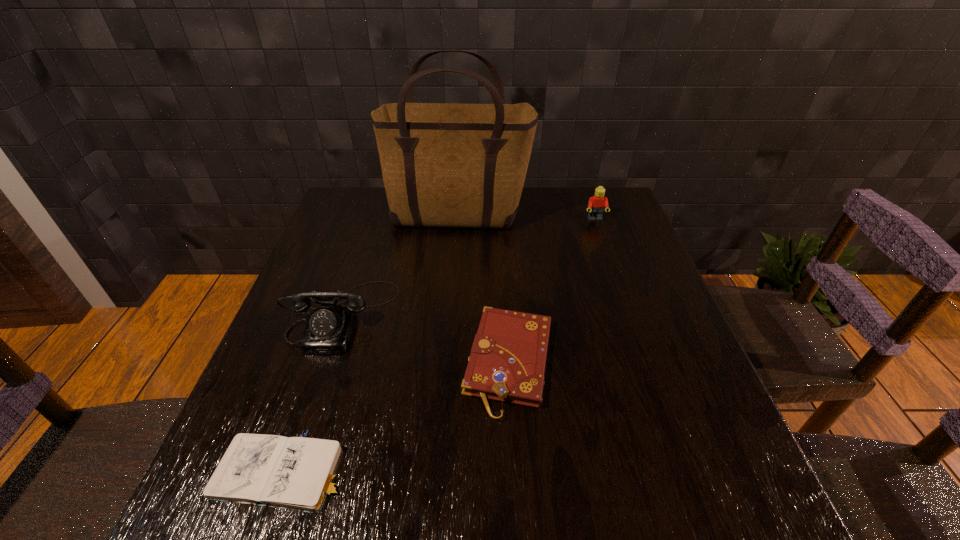
You are a GUI agent. You are given a task and a screenshot of the screen. Output one action in this format:
    pyautogui.click(x=<x>, y=<y>)
    Task: Click on the free region located 0.120m on the back of the second shortest object
    
    Given the screenshot: What is the action you would take?
    pyautogui.click(x=504, y=281)

This screenshot has height=540, width=960. What are the coordinates of `vacant space located on the back of the nearer notebook` in the screenshot? It's located at (346, 286).

Identify the location of tote bag positioned at the far edge. This screenshot has width=960, height=540. (456, 165).

At what (x,y) coordinates should I click in order to perform the action: click on Lego that is positioned at the far edge. Please return your answer as a coordinate pair (x, y). The width and height of the screenshot is (960, 540). Looking at the image, I should click on (596, 204).

Where is `object that is positioned at the near edge`? This screenshot has height=540, width=960. object that is positioned at the near edge is located at coordinates (296, 473).

Locate an element on the screen. The width and height of the screenshot is (960, 540). telephone that is at the left edge is located at coordinates [329, 328].

Where is `notebook located in the left edge section of the desktop`? The width and height of the screenshot is (960, 540). notebook located in the left edge section of the desktop is located at coordinates (296, 473).

Find the location of `object that is at the right edge`. object that is at the right edge is located at coordinates (596, 204).

The height and width of the screenshot is (540, 960). I want to click on object situated at the near left corner, so click(x=296, y=473).

Image resolution: width=960 pixels, height=540 pixels. I want to click on object located at the far right corner, so click(596, 204).